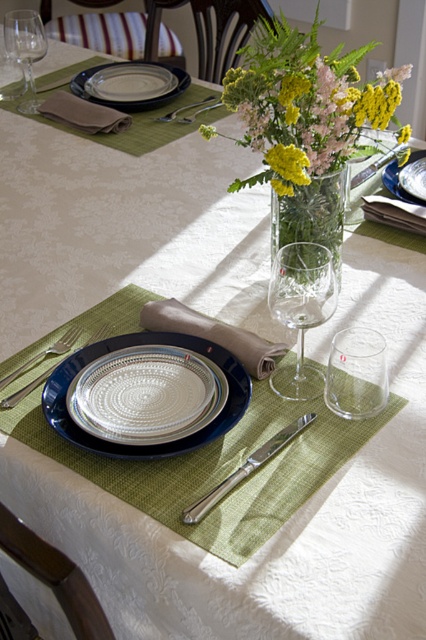
Is point (166, 412) positioned behind point (46, 108)?

No, (166, 412) is in front of (46, 108).

Who is positioned more to the right, silver textured plate at center or brown cloth at upper left?

silver textured plate at center

Locate an element on the screen. silver textured plate at center is located at coordinates (146, 394).

The width and height of the screenshot is (426, 640). I want to click on silver textured plate at center, so click(x=146, y=394).

Can you confirm if green woven placemat at center is shorter than beige fabric napkin at center?

No, green woven placemat at center is not shorter than beige fabric napkin at center.

Is green woven placemat at center thinner than beige fabric napkin at center?

No.

Locate an element on the screen. This screenshot has height=640, width=426. green woven placemat at center is located at coordinates (218, 468).

The width and height of the screenshot is (426, 640). Identify the location of green woven placemat at center. (218, 468).

Between point (273, 173) and point (45, 355), which one is positioned behind?

The point (273, 173) is more distant.

Does yellow textured flowers at upper center have a greater width compared to silver metallic fork at lower left?

Yes, yellow textured flowers at upper center is wider than silver metallic fork at lower left.

Is point (367, 84) less distant than point (11, 380)?

Yes, point (367, 84) is closer to viewer.

Locate an element on the screen. This screenshot has width=426, height=640. yellow textured flowers at upper center is located at coordinates coord(305,104).